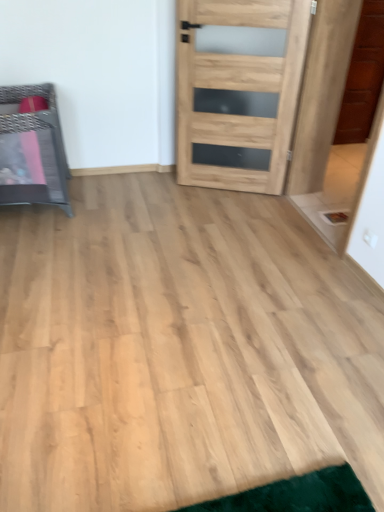
You are a GUI agent. You are given a task and a screenshot of the screen. Output one action in this format:
    pyautogui.click(x=<x>, y=<y>)
    Task: Click on the blank area to the left of natural wood door at center
    
    Given the screenshot: What is the action you would take?
    pyautogui.click(x=168, y=196)